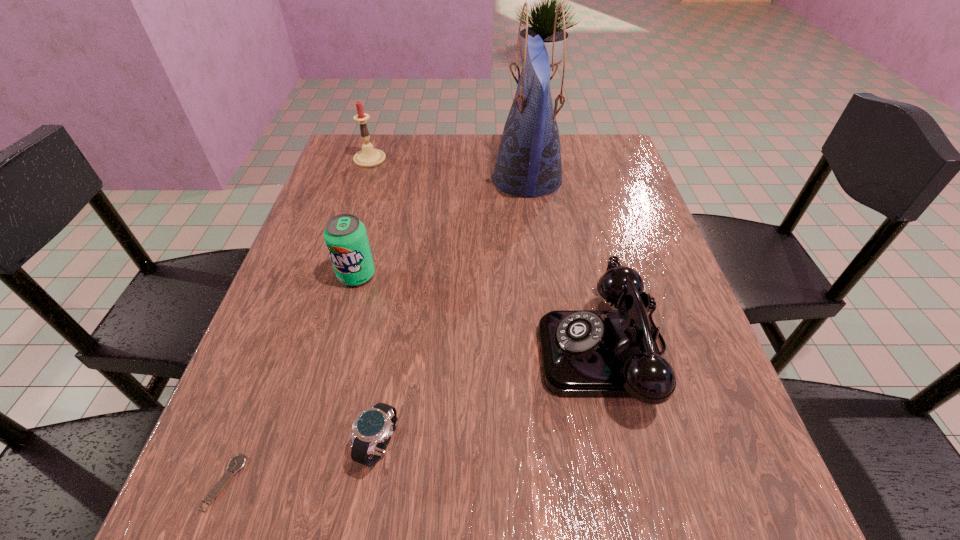
Locate an element on the screen. blank space located on the front-facing side of the pop soda is located at coordinates (296, 501).

You are a GUI agent. You are given a task and a screenshot of the screen. Output one action in this format:
    pyautogui.click(x=<x>, y=<y>)
    Task: Click on the vacant space located on the dial of the telephone
    The width and height of the screenshot is (960, 540).
    Given the screenshot: What is the action you would take?
    pyautogui.click(x=356, y=350)

This screenshot has height=540, width=960. I want to click on free space located on the dial of the telephone, so click(x=434, y=350).

Where is `free region located 0.390m on the dial of the telephone`? free region located 0.390m on the dial of the telephone is located at coordinates (323, 350).

Identify the location of vacant area located on the back of the fifth tallest object. The height and width of the screenshot is (540, 960). (396, 350).

Image resolution: width=960 pixels, height=540 pixels. I want to click on vacant space located on the back of the left watch, so click(274, 353).

Image resolution: width=960 pixels, height=540 pixels. I want to click on shopping bag located at the far edge, so pos(528,163).

Locate an element on the screen. This screenshot has height=540, width=960. candle located at the far edge is located at coordinates (368, 157).

This screenshot has height=540, width=960. Find the location of `object present at the near edge`. object present at the near edge is located at coordinates (238, 462).

Where is `candle positioned at the left edge`? The width and height of the screenshot is (960, 540). candle positioned at the left edge is located at coordinates (368, 157).